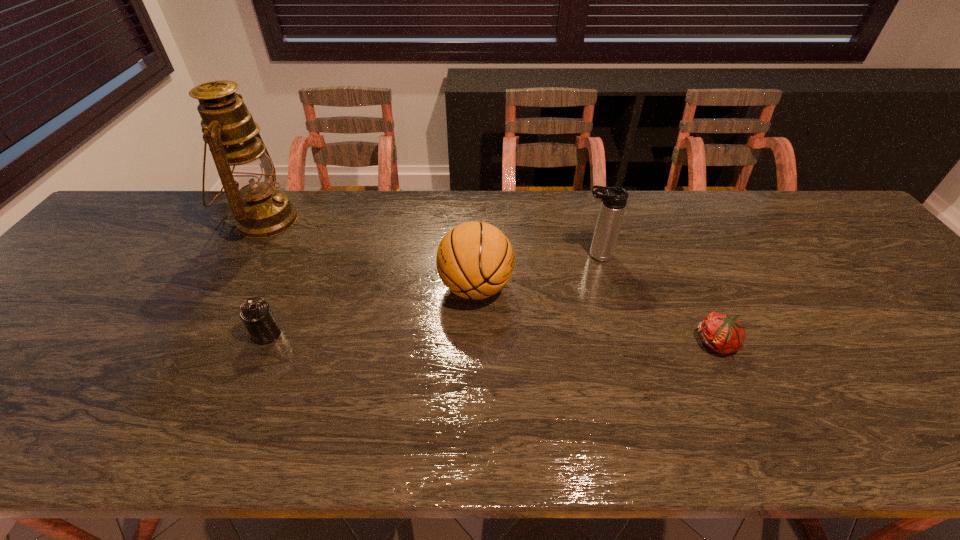
Locate which object is the closest to the thermos bottle. Please provide its 2D coordinates. Your answer should be formatted as a tuple, i.e. [(x, y)], where the tuple contains the x and y coordinates of a point satisfying the conditions above.

[(475, 260)]

Locate an element on the screen. The height and width of the screenshot is (540, 960). vacant space that satisfies the following two spatial constraints: 1. on the surface of the third object from right to left near the brand logo; 2. on the right side of the tomato is located at coordinates (475, 343).

Identify the location of free location that satisfies the following two spatial constraints: 1. on the surface of the basketball near the brand logo; 2. on the right side of the shortest object. This screenshot has height=540, width=960. (475, 343).

Where is `free space in the image that satisfies the following two spatial constraints: 1. on the front side of the can; 2. on the right side of the tomato`? The width and height of the screenshot is (960, 540). free space in the image that satisfies the following two spatial constraints: 1. on the front side of the can; 2. on the right side of the tomato is located at coordinates (263, 343).

Where is `vacant position in the image that satisfies the following two spatial constraints: 1. on the back side of the rightmost object; 2. on the surface of the third object from right to left near the brand logo`? vacant position in the image that satisfies the following two spatial constraints: 1. on the back side of the rightmost object; 2. on the surface of the third object from right to left near the brand logo is located at coordinates (691, 287).

At what (x,y) coordinates should I click in order to perform the action: click on free point that satisfies the following two spatial constraints: 1. on the surface of the third object from right to left near the brand logo; 2. on the front side of the fourth object from right to left. Please return your answer as a coordinate pair (x, y). This screenshot has height=540, width=960. Looking at the image, I should click on (475, 334).

I want to click on blank space that satisfies the following two spatial constraints: 1. on the handle side of the shortest object; 2. on the right side of the fourth object from left to right, so click(620, 343).

The width and height of the screenshot is (960, 540). In order to click on free location that satisfies the following two spatial constraints: 1. on the front side of the can; 2. on the right side of the rightmost object in this screenshot , I will do `click(263, 343)`.

What are the coordinates of `free spot that satisfies the following two spatial constraints: 1. on the front side of the can; 2. on the left side of the tomato` in the screenshot? It's located at (263, 343).

Where is `vacant area in the image that satisfies the following two spatial constraints: 1. on the front side of the fourth object from right to left; 2. on the right side of the tallest object`? vacant area in the image that satisfies the following two spatial constraints: 1. on the front side of the fourth object from right to left; 2. on the right side of the tallest object is located at coordinates (201, 334).